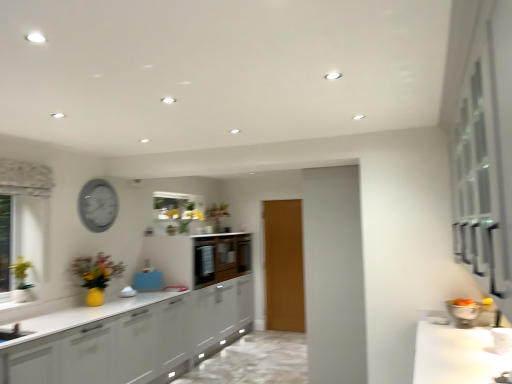
Identify the location of white glossy countertop at lower right. (456, 355).

Image resolution: width=512 pixels, height=384 pixels. What do you see at coordinates (98, 205) in the screenshot? I see `matte gray clock at upper left` at bounding box center [98, 205].

Identify the location of matte gray clock at upper left. (98, 205).

At what (x,y) coordinates should I click in order to perform the action: click on matte white vase at left, which is the 1th floral arrangement from left to right. Please return your answer as a coordinate pair (x, y). The height and width of the screenshot is (384, 512). Looking at the image, I should click on (21, 273).

What do you see at coordinates (97, 270) in the screenshot? I see `yellow matte vase at left` at bounding box center [97, 270].

Where is `yellow matte floral arrangement at center, the 2th floral arrangement positioned from the front`? yellow matte floral arrangement at center, the 2th floral arrangement positioned from the front is located at coordinates (183, 217).

Image resolution: width=512 pixels, height=384 pixels. Describe the element at coordinates (200, 258) in the screenshot. I see `matte brown cabinetry at center` at that location.

Image resolution: width=512 pixels, height=384 pixels. I want to click on white glossy countertop at lower right, so click(456, 355).

Considering the points (193, 204) and (298, 282), which point is in front, point (193, 204) or point (298, 282)?

The point (193, 204) is closer.

Consider the image. Looking at the image, does yellow matte floral arrangement at center, the 2th floral arrangement positioned from the front, seem bigger or smaller compared to wooden door at center?

Considering their sizes, yellow matte floral arrangement at center, the 2th floral arrangement positioned from the front, takes up less space than wooden door at center.

Considering the relative positions of yellow matte floral arrangement at center, the 2th floral arrangement positioned from the front, and wooden door at center in the image provided, is yellow matte floral arrangement at center, the 2th floral arrangement positioned from the front, to the left or to the right of wooden door at center?

In the image, yellow matte floral arrangement at center, the 2th floral arrangement positioned from the front, appears on the left side of wooden door at center.

How far apart are matte brown cabinetry at center and matte white vase at left, the second floral arrangement in the right-to-left sequence?

matte brown cabinetry at center is 6.36 feet from matte white vase at left, the second floral arrangement in the right-to-left sequence.

From a real-world perspective, which object rests below the other?

From a 3D spatial view, matte brown cabinetry at center is below.

Is matte brown cabinetry at center turned away from matte white vase at left, which appears as the second floral arrangement when viewed from the top?

No.

Is point (175, 231) more distant than point (452, 348)?

Yes, it is.

Which object is positioned more to the left, yellow matte floral arrangement at center, the 2th floral arrangement positioned from the front, or white glossy countertop at lower right?

yellow matte floral arrangement at center, the 2th floral arrangement positioned from the front.

From a real-world perspective, is yellow matte floral arrangement at center, the first floral arrangement from the top, physically below white glossy countertop at lower right?

No.

In the image, is yellow matte floral arrangement at center, the 2th floral arrangement positioned from the front, positioned in front of or behind white glossy countertop at lower right?

Visually, yellow matte floral arrangement at center, the 2th floral arrangement positioned from the front, is located behind white glossy countertop at lower right.

Where is `clock located on the left of yellow matte floral arrangement at center, the 2th floral arrangement when ordered from left to right`? This screenshot has width=512, height=384. clock located on the left of yellow matte floral arrangement at center, the 2th floral arrangement when ordered from left to right is located at coordinates (98, 205).

From the picture: Is the depth of matte gray clock at upper left greater than that of yellow matte floral arrangement at center, the first floral arrangement from the top?

→ No, it is in front of yellow matte floral arrangement at center, the first floral arrangement from the top.

Is yellow matte floral arrangement at center, arranged as the first floral arrangement when viewed from the back, completely or partially inside matte gray clock at upper left?

That's incorrect, yellow matte floral arrangement at center, arranged as the first floral arrangement when viewed from the back, is not inside matte gray clock at upper left.

Which of these two, matte gray clock at upper left or yellow matte floral arrangement at center, positioned as the second floral arrangement in bottom-to-top order, is bigger?

yellow matte floral arrangement at center, positioned as the second floral arrangement in bottom-to-top order.

Can you confirm if white glossy countertop at lower right is positioned to the left of wooden door at center?

No, white glossy countertop at lower right is not to the left of wooden door at center.

Does point (503, 355) lie behind point (271, 226)?

No.

Looking at this image, can you see white glossy countertop at lower right touching wooden door at center?

Answer: No.

Is wooden door at center located within white glossy countertop at lower right?

That's incorrect, wooden door at center is not inside white glossy countertop at lower right.

How many degrees apart are the facing directions of matte gray clock at upper left and yellow matte vase at left?

The facing directions of matte gray clock at upper left and yellow matte vase at left are 0.252 degrees apart.

From a real-world perspective, relative to yellow matte vase at left, is matte gray clock at upper left vertically above or below?

From a real-world perspective, matte gray clock at upper left is physically above yellow matte vase at left.

Can we say matte gray clock at upper left lies outside yellow matte vase at left?

Yes, matte gray clock at upper left is outside of yellow matte vase at left.

Is matte gray clock at upper left far from yellow matte vase at left?

No, matte gray clock at upper left is not far from yellow matte vase at left.

Is yellow matte vase at left in front of matte gray clock at upper left?

Yes, yellow matte vase at left is closer to the viewer.

Can you confirm if yellow matte vase at left is taller than matte gray clock at upper left?

No, yellow matte vase at left is not taller than matte gray clock at upper left.

Is yellow matte vase at left to the right of matte gray clock at upper left from the viewer's perspective?

Indeed, yellow matte vase at left is positioned on the right side of matte gray clock at upper left.

Would you consider yellow matte vase at left to be distant from matte gray clock at upper left?

Actually, yellow matte vase at left and matte gray clock at upper left are a little close together.

At what (x,y) coordinates should I click in order to perform the action: click on floral arrangement that is the 1st object located in front of the wooden door at center. Please return your answer as a coordinate pair (x, y). The width and height of the screenshot is (512, 384). Looking at the image, I should click on (183, 217).

From the image's perspective, starting from the matte brown cabinetry at center, which floral arrangement is the 1st one above? Please provide its 2D coordinates.

[(21, 273)]

Estimate the real-world distances between objects in this image. Which object is further from matte brown cabinetry at center, matte white vase at left, the second floral arrangement in the back-to-front sequence, or wooden door at center?

The object further to matte brown cabinetry at center is matte white vase at left, the second floral arrangement in the back-to-front sequence.

Estimate the real-world distances between objects in this image. Which object is closer to yellow matte vase at left, yellow matte floral arrangement at center, the 2th floral arrangement when ordered from left to right, or matte white vase at left, the first floral arrangement from the bottom?

matte white vase at left, the first floral arrangement from the bottom.

From the picture: Looking at the image, which one is located further to yellow matte floral arrangement at center, positioned as the second floral arrangement in bottom-to-top order, matte white vase at left, the second floral arrangement in the back-to-front sequence, or matte gray clock at upper left?

The object further to yellow matte floral arrangement at center, positioned as the second floral arrangement in bottom-to-top order, is matte white vase at left, the second floral arrangement in the back-to-front sequence.

When comparing their distances from yellow matte vase at left, does wooden door at center or matte gray clock at upper left seem closer?

matte gray clock at upper left is positioned closer to the anchor yellow matte vase at left.

From the image, which object appears to be nearer to yellow matte floral arrangement at center, arranged as the first floral arrangement when viewed from the back, yellow matte vase at left or matte gray clock at upper left?

matte gray clock at upper left is positioned closer to the anchor yellow matte floral arrangement at center, arranged as the first floral arrangement when viewed from the back.

In the scene shown: Looking at the image, which one is located further to matte white vase at left, the first floral arrangement from the bottom, yellow matte vase at left or matte brown cabinetry at center?

matte brown cabinetry at center.

Which object lies further to the anchor point matte brown cabinetry at center, white glossy countertop at lower right or matte gray clock at upper left?

The object further to matte brown cabinetry at center is white glossy countertop at lower right.

From the image, which object appears to be farther from white glossy countertop at lower right, matte gray clock at upper left or wooden door at center?

matte gray clock at upper left lies further to white glossy countertop at lower right than the other object.

The height and width of the screenshot is (384, 512). I want to click on flower situated between matte white vase at left, the second floral arrangement in the right-to-left sequence, and white glossy countertop at lower right from left to right, so click(97, 270).

At what (x,y) coordinates should I click in order to perform the action: click on cabinetry between white glossy countertop at lower right and wooden door at center along the z-axis. Please return your answer as a coordinate pair (x, y). This screenshot has height=384, width=512. Looking at the image, I should click on (200, 258).

Locate an element on the screen. The height and width of the screenshot is (384, 512). flower positioned between white glossy countertop at lower right and matte brown cabinetry at center from near to far is located at coordinates (97, 270).

You are a GUI agent. You are given a task and a screenshot of the screen. Output one action in this format:
    pyautogui.click(x=<x>, y=<y>)
    Task: Click on the clock between yellow matte vase at left and yellow matte floral arrangement at center, the 2th floral arrangement positioned from the front, along the z-axis
    The width and height of the screenshot is (512, 384).
    Given the screenshot: What is the action you would take?
    pyautogui.click(x=98, y=205)